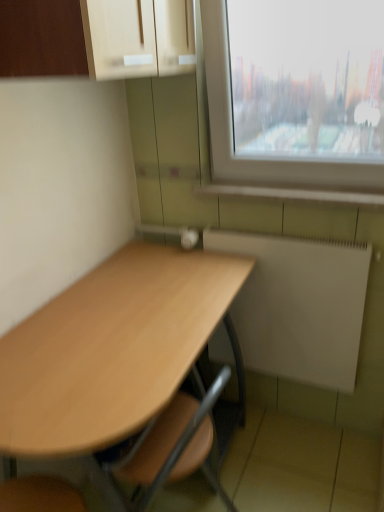
Question: From a real-world perspective, is light brown wood desk at center physically located above or below white matte radiator at lower right?

Choices:
 (A) above
 (B) below

Answer: (B)

Question: Is light brown wood desk at center bigger or smaller than white matte radiator at lower right?

Choices:
 (A) big
 (B) small

Answer: (A)

Question: Which object is positioned closest to the matte wood cabinet at upper left?

Choices:
 (A) white tile at lower right
 (B) light brown wood desk at center
 (C) white matte radiator at lower right

Answer: (A)

Question: Which of these objects is positioned farthest from the light brown wood desk at center?

Choices:
 (A) white tile at lower right
 (B) white matte radiator at lower right
 (C) matte wood cabinet at upper left

Answer: (C)